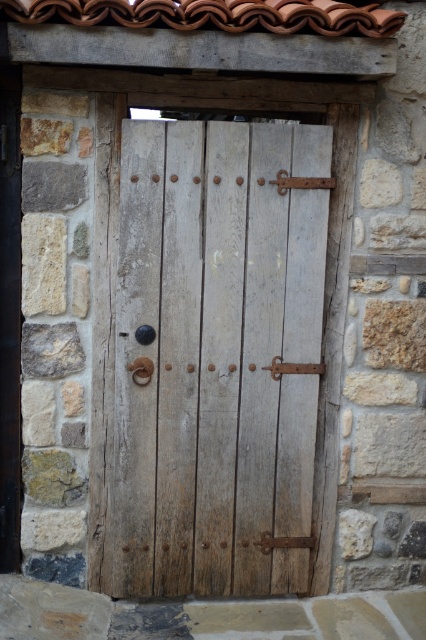
You are a delivery person trying to reach the doorbell. You see the weathered wood door at center and the terracotta clay tiles at upper center. Which object is located above the other?

The terracotta clay tiles at upper center are located above the weathered wood door at center.